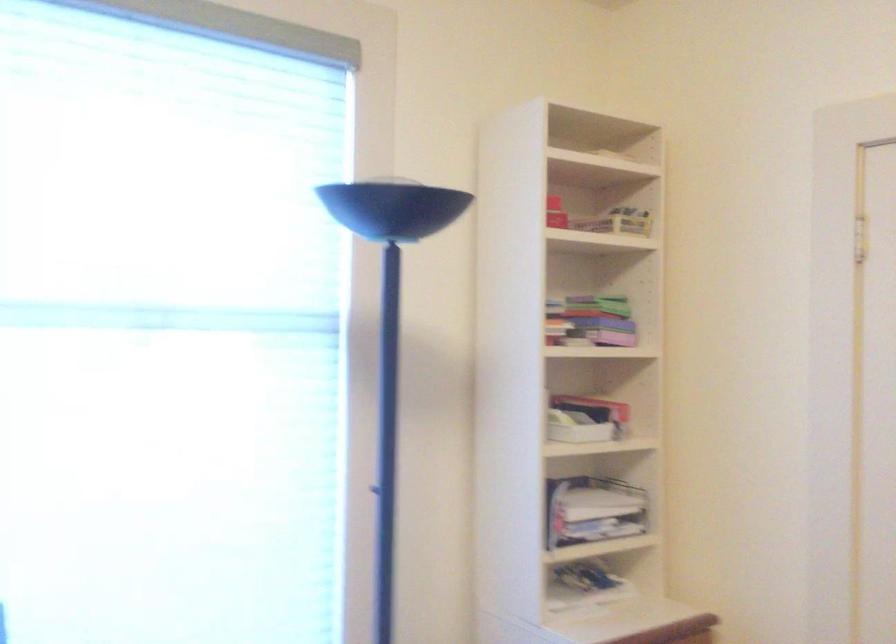
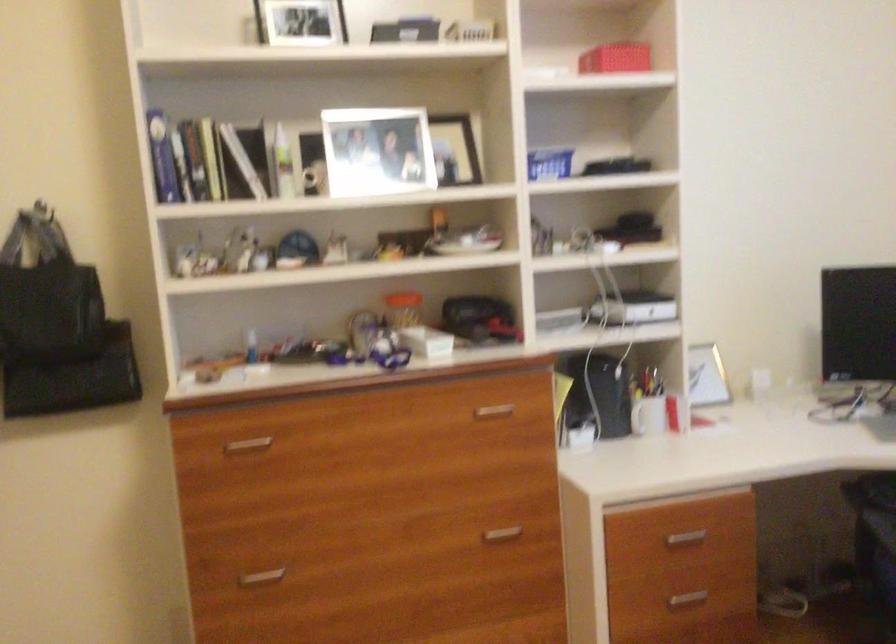
Question: The camera is either moving clockwise (left) or counter-clockwise (right) around the object. The first image is from the beginning of the video and the second image is from the end. Is the camera moving left or right when shooting the video?

Choices:
 (A) Left
 (B) Right

Answer: (B)